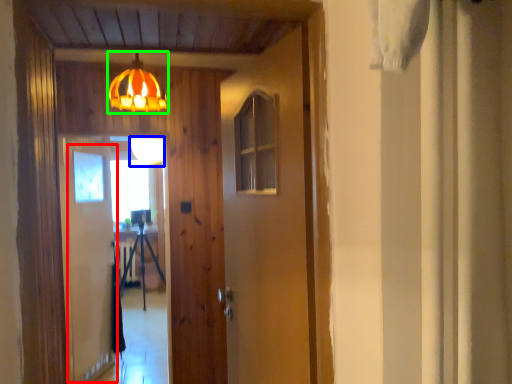
Question: Based on their relative distances, which object is nearer to screen door (highlighted by a red box)? Choose from lamp (highlighted by a blue box) and lamp (highlighted by a green box).

Choices:
 (A) lamp
 (B) lamp

Answer: (A)